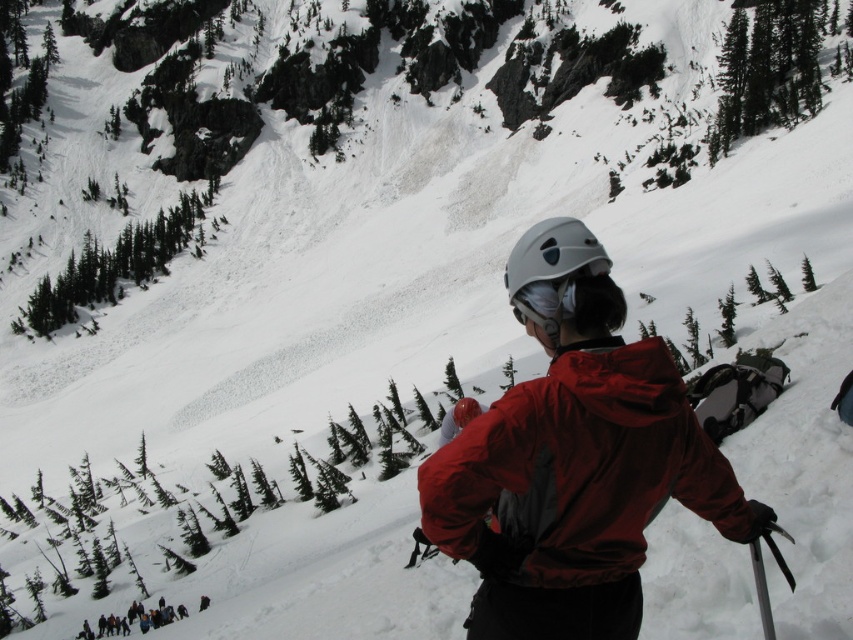
You are a photographer trying to capture the red matte jacket at center in the snowy mountain landscape. Where exactly should you aim your camera to ensure the jacket is in the frame?

You should aim your camera at the coordinates point (579, 470) to capture the red matte jacket at center.

You are a photographer aiming to capture the skier in the scene. Which object, the red matte jacket at center or the white matte helmet at center, should you focus on first if you want to photograph the lower part of the skier?

The red matte jacket at center is located below the white matte helmet at center, so you should focus on the red matte jacket at center first to capture the lower part of the skier.

You are a photographer trying to capture the skier in the scene. You notice the red matte jacket at center and the white matte helmet at center. Which object should you focus on first if you want to ensure both are in sharp focus?

You should focus on the red matte jacket at center first because it is closer to the viewer than the white matte helmet at center. By focusing on the closer object, the helmet will also be in focus due to the depth of field.